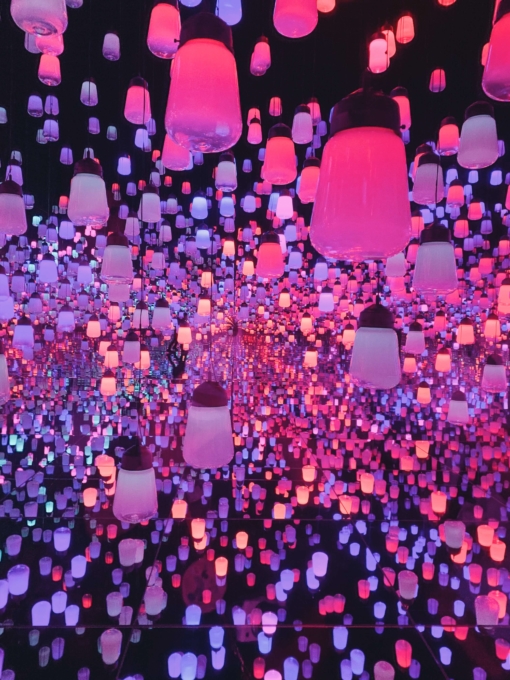
This screenshot has height=680, width=510. Find the location of `mirrored tiles lines`. mirrored tiles lines is located at coordinates (351, 596), (397, 539), (175, 579), (116, 638), (128, 589), (237, 581).